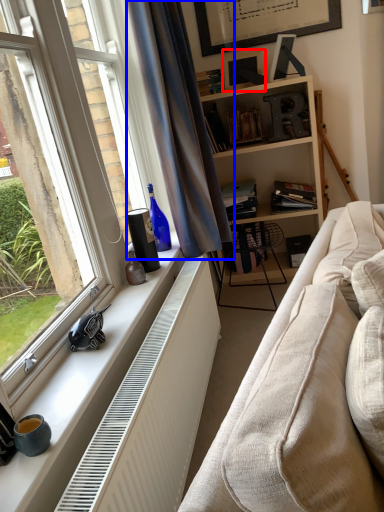
Question: Which of the following is the closest to the observer, picture frame (highlighted by a red box) or curtain (highlighted by a blue box)?

Choices:
 (A) picture frame
 (B) curtain

Answer: (B)